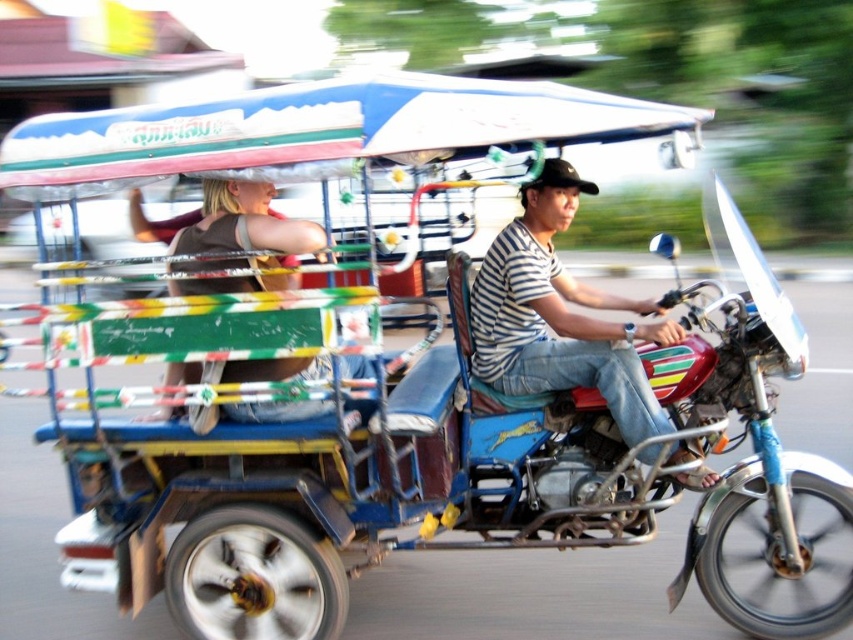
You are standing at the point marked as point (341,492) and want to get to the passenger seat of the tuk tuk. Which direction should you move in?

The metallic blue motorcycle at center is located at point (341,492). To reach the passenger seat of the tuk tuk, you should move away from the motorcycle towards the back of the tuk tuk.

You are a passenger in the tuk tuk and need to reach the striped shirt at center to hand the driver a map. Can you safely reach it without leaning too far?

The striped shirt at center is located at point (x=560, y=316), which is within a safe distance for the passenger to reach without leaning too far.